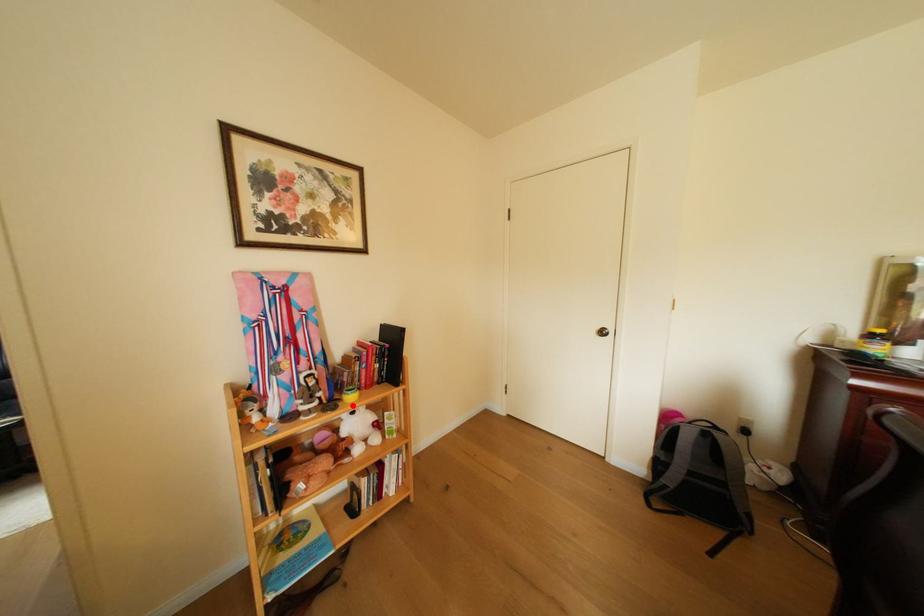
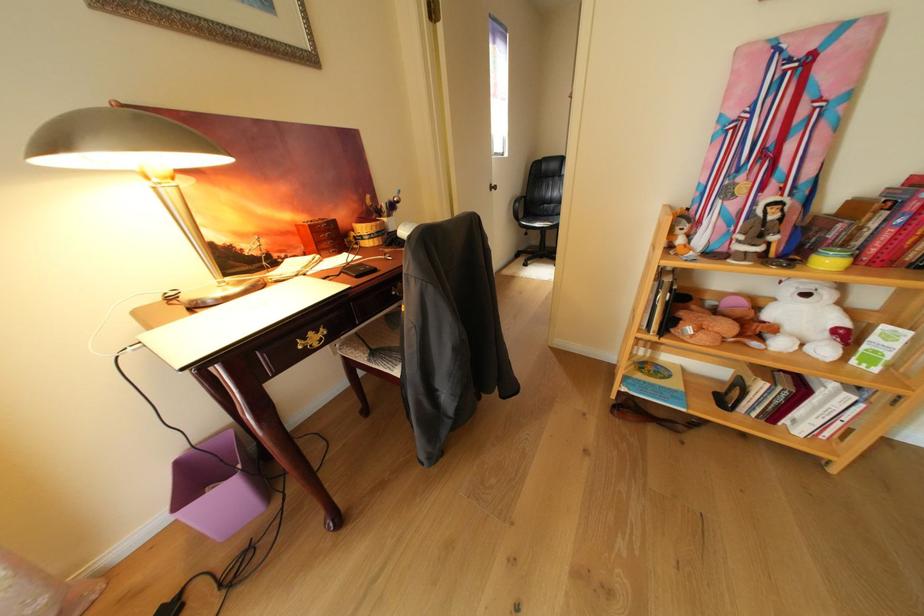
Question: I am providing you with two images of the same scene from different viewpoints. A red point is marked on the first image. Can you still see the location of the red point in image 2?

Choices:
 (A) Yes
 (B) No

Answer: (A)